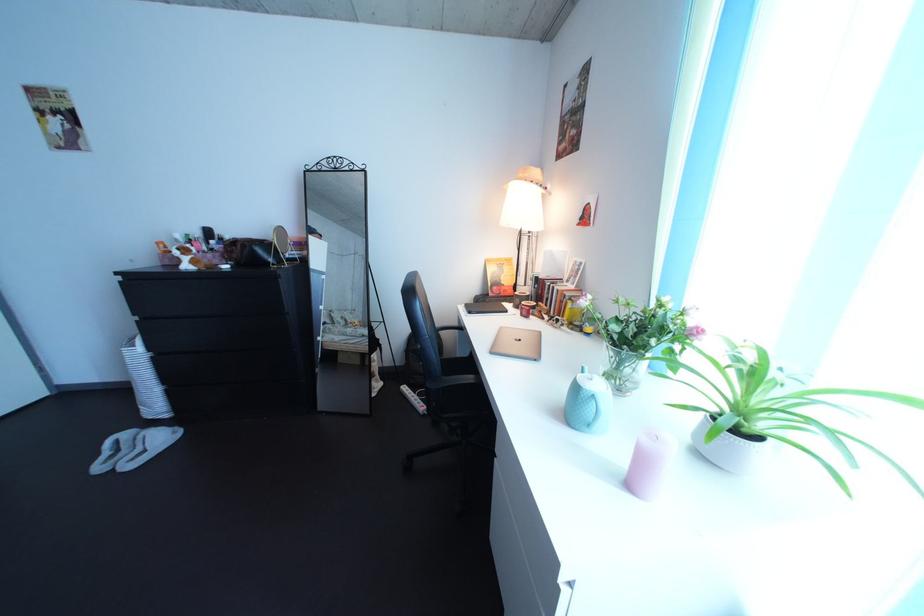
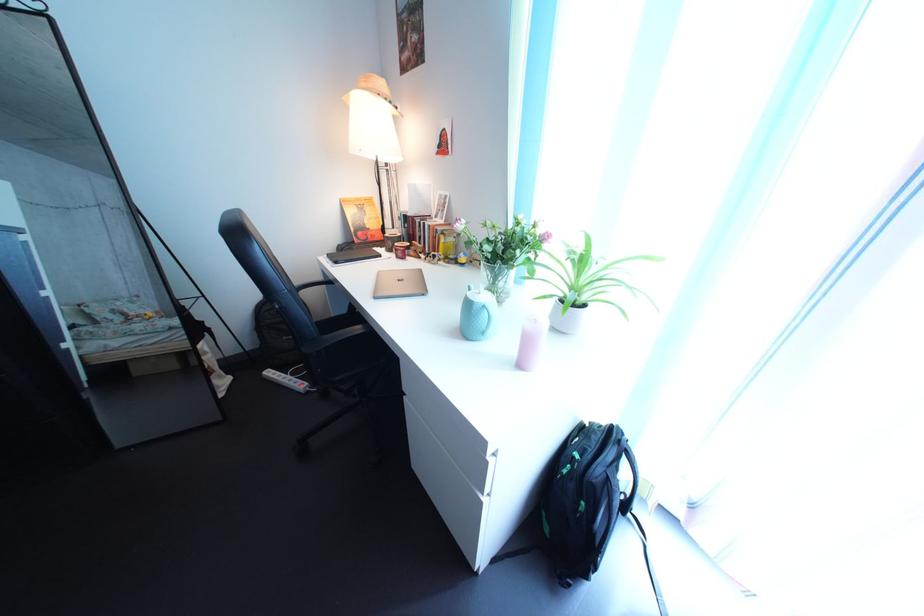
Find the pixel in the second image that matches point (536, 184) in the first image.

(378, 92)